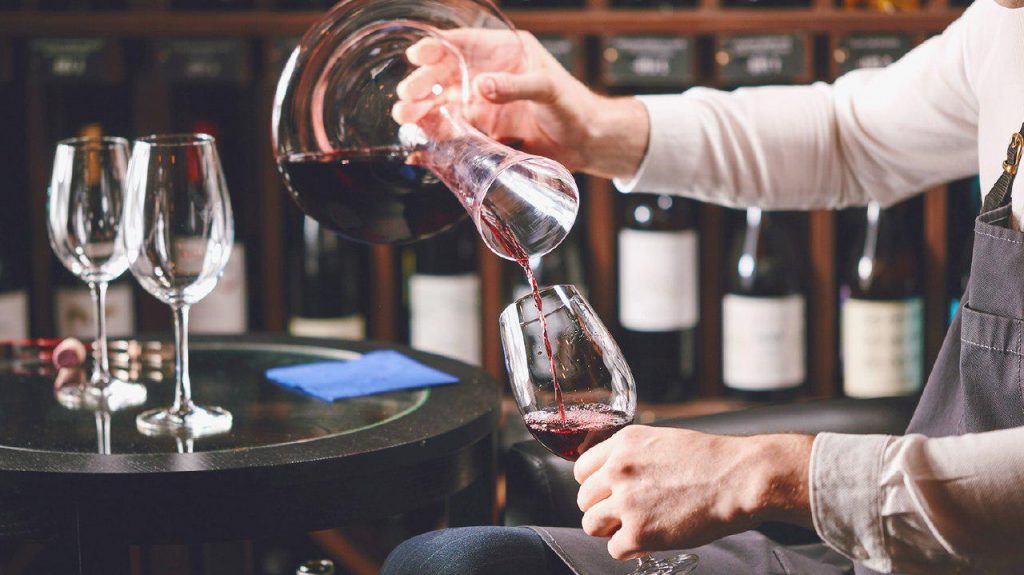
This screenshot has height=575, width=1024. Identify the location of wine bottles. (7, 304), (66, 302), (222, 304), (318, 289), (445, 270), (568, 256), (643, 283), (765, 329), (877, 319), (958, 286).